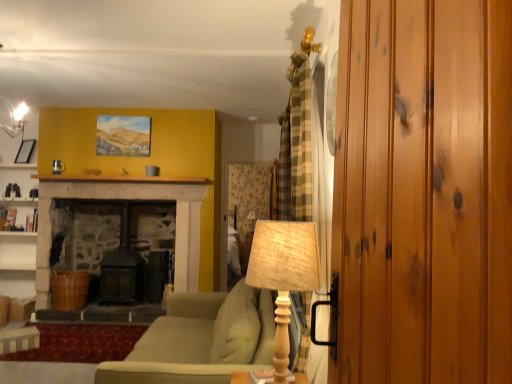
The height and width of the screenshot is (384, 512). In order to click on free location above matte black picture frame at upper left (from a real-world perspective) in this screenshot , I will do `click(25, 131)`.